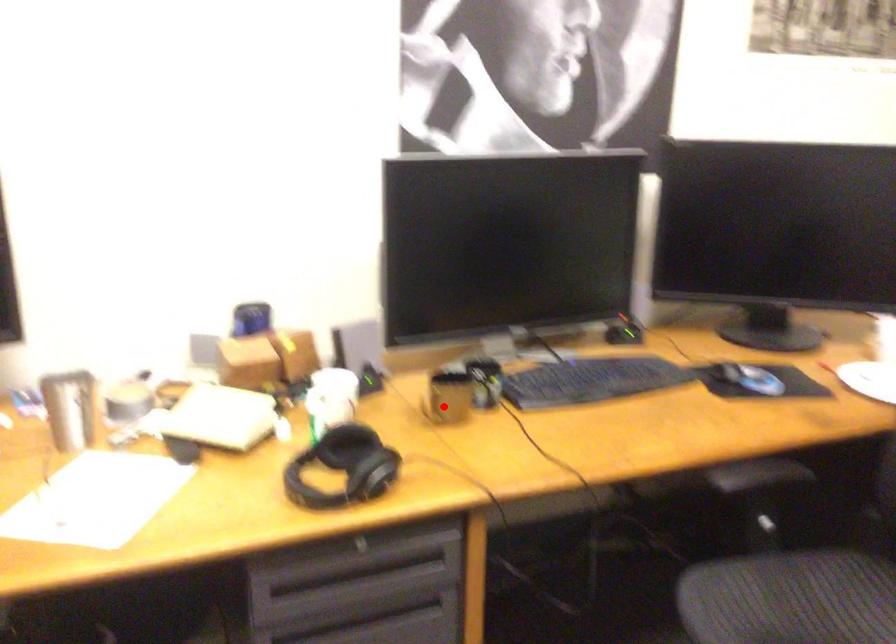
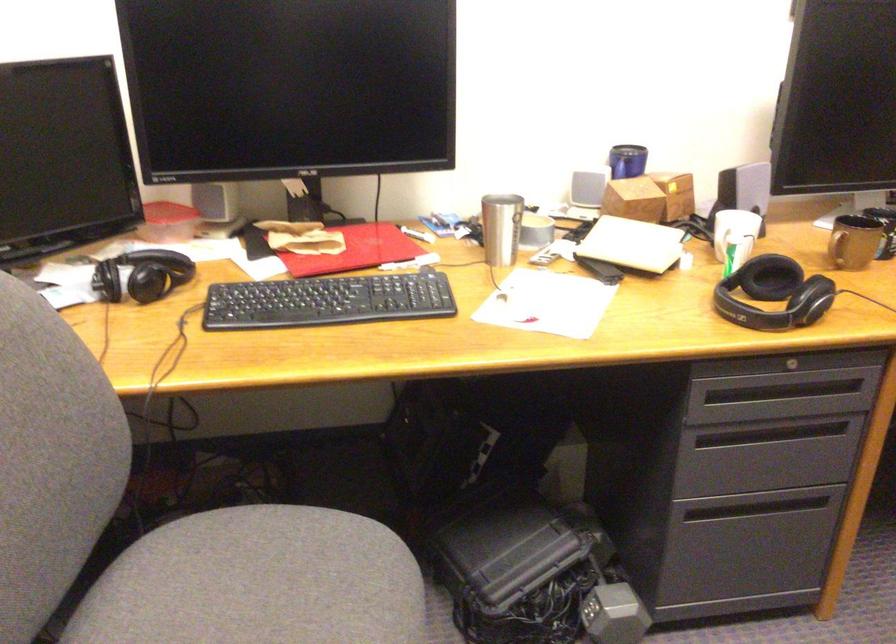
The point at the highlighted location is marked in the first image. Where is the corresponding point in the second image?

(854, 242)